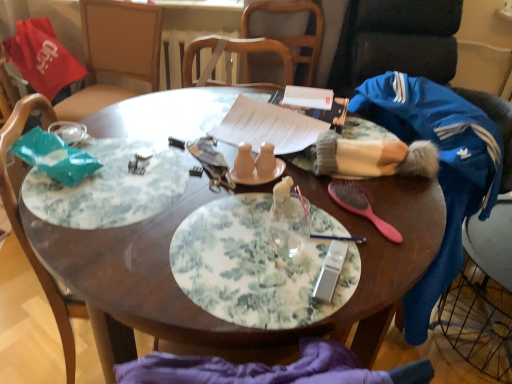
You are a GUI agent. You are given a task and a screenshot of the screen. Output one action in this format:
    pyautogui.click(x=<x>, y=<y>)
    Task: Click on the vacant region to the left of matte ceramic salt and pepper shakers at center, marked as the third tableware in a left-to-right arrangement
    
    Given the screenshot: What is the action you would take?
    pyautogui.click(x=186, y=181)